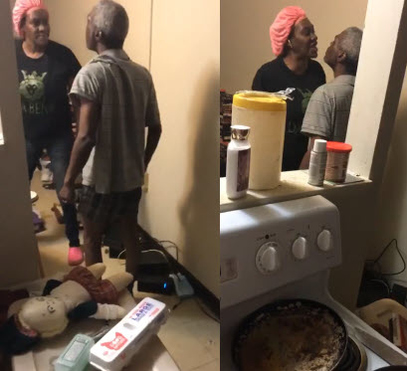
Find the location of a particular element. This screenshot has height=371, width=407. doll's head is located at coordinates (43, 311).